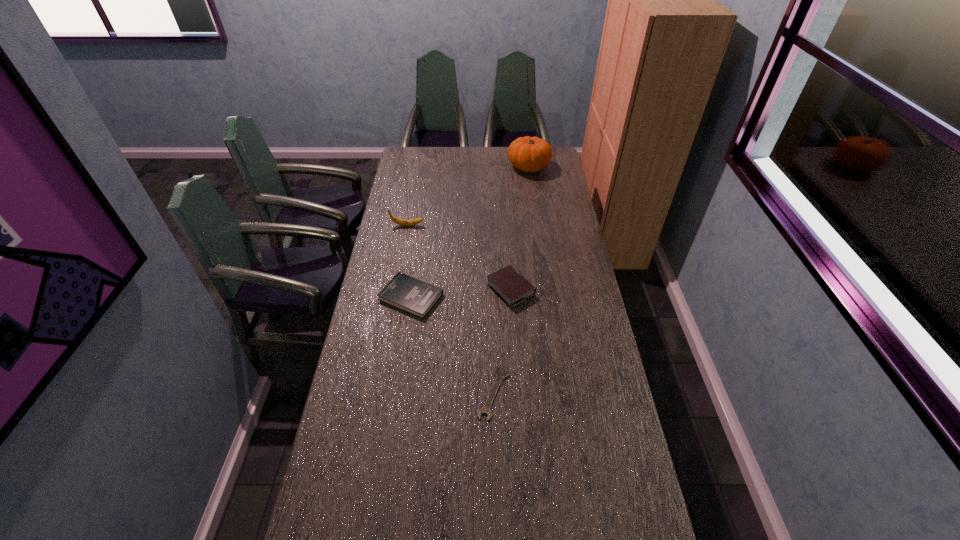
At what (x,y) coordinates should I click in order to perform the action: click on free space located on the right of the third tallest object. Please return your answer as a coordinate pair (x, y). Looking at the image, I should click on (565, 289).

This screenshot has width=960, height=540. In order to click on free space located 0.220m on the front of the fourth tallest object in this screenshot , I will do `click(400, 370)`.

This screenshot has width=960, height=540. Identify the location of vacant space positioned 0.080m on the back of the wrench. (492, 348).

Locate an element on the screen. object present at the far edge is located at coordinates (530, 154).

At what (x,y) coordinates should I click in order to perform the action: click on banana that is at the left edge. Please return your answer as a coordinate pair (x, y). This screenshot has width=960, height=540. Looking at the image, I should click on (402, 222).

In order to click on book positioned at the left edge in this screenshot , I will do `click(404, 292)`.

Identify the location of object that is at the right edge. (530, 154).

This screenshot has height=540, width=960. What are the coordinates of `object that is positioned at the far right corner` in the screenshot? It's located at (530, 154).

Find the location of a particular element. The height and width of the screenshot is (540, 960). vacant region at the far edge is located at coordinates (480, 165).

The width and height of the screenshot is (960, 540). In the image, there is a desktop. Find the location of `vacant region at the left edge`. vacant region at the left edge is located at coordinates pos(417,191).